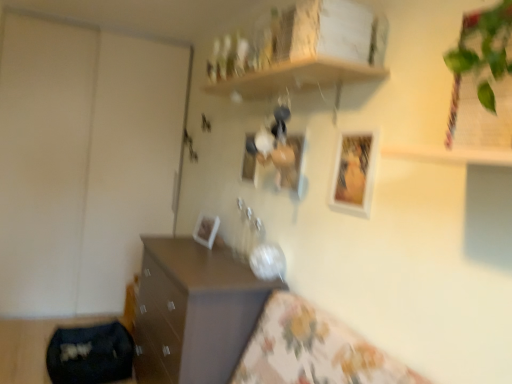
Question: Can we say matte white picture frame at center, the third picture frame positioned from the left, lies outside green leafy plant at upper right?

Choices:
 (A) yes
 (B) no

Answer: (A)

Question: From the image's perspective, is matte white picture frame at center, which is the 2th picture frame in front-to-back order, located beneath green leafy plant at upper right?

Choices:
 (A) yes
 (B) no

Answer: (A)

Question: Is matte white picture frame at center, the third picture frame positioned from the left, facing away from green leafy plant at upper right?

Choices:
 (A) no
 (B) yes

Answer: (A)

Question: From a real-world perspective, is matte white picture frame at center, which is the 2th picture frame in front-to-back order, on green leafy plant at upper right?

Choices:
 (A) yes
 (B) no

Answer: (B)

Question: Does matte white picture frame at center, acting as the 2th picture frame starting from the right, appear on the right side of green leafy plant at upper right?

Choices:
 (A) no
 (B) yes

Answer: (A)

Question: Does matte white picture frame at center, which is the 3th picture frame from back to front, have a lesser width compared to green leafy plant at upper right?

Choices:
 (A) no
 (B) yes

Answer: (B)

Question: Is white glossy picture frame at upper center, the 1th picture frame when ordered from front to back, positioned far away from green leafy plant at upper right?

Choices:
 (A) yes
 (B) no

Answer: (B)

Question: Can you confirm if white glossy picture frame at upper center, the 1th picture frame when ordered from front to back, is smaller than green leafy plant at upper right?

Choices:
 (A) yes
 (B) no

Answer: (A)

Question: From a real-world perspective, is white glossy picture frame at upper center, acting as the fourth picture frame starting from the back, below green leafy plant at upper right?

Choices:
 (A) yes
 (B) no

Answer: (A)

Question: Considering the relative sizes of white glossy picture frame at upper center, the 1th picture frame when ordered from front to back, and green leafy plant at upper right in the image provided, is white glossy picture frame at upper center, the 1th picture frame when ordered from front to back, bigger than green leafy plant at upper right?

Choices:
 (A) no
 (B) yes

Answer: (A)

Question: Is white glossy picture frame at upper center, the 1th picture frame when ordered from front to back, taller than green leafy plant at upper right?

Choices:
 (A) yes
 (B) no

Answer: (B)

Question: Is white glossy picture frame at upper center, the 1th picture frame when ordered from front to back, surrounding green leafy plant at upper right?

Choices:
 (A) yes
 (B) no

Answer: (B)

Question: Are matte brown chest of drawers at lower left and matte white picture frame at center, acting as the 2th picture frame starting from the right, beside each other?

Choices:
 (A) no
 (B) yes

Answer: (A)